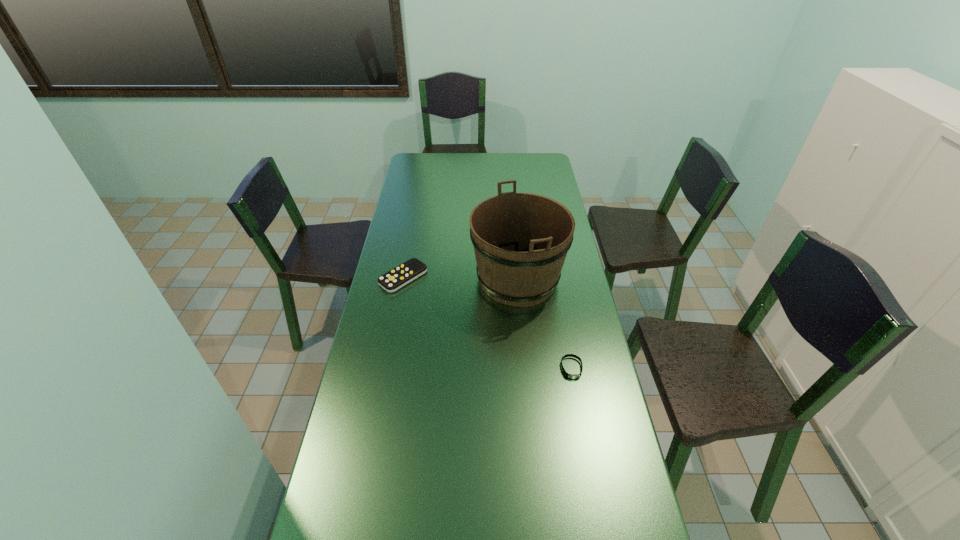
Where is `wristband positioned at the right edge`? Image resolution: width=960 pixels, height=540 pixels. wristband positioned at the right edge is located at coordinates (x=573, y=376).

Identify the location of free space at the far edge. (x=473, y=154).

Locate an element on the screen. free region at the left edge of the desktop is located at coordinates (356, 463).

Find the location of a particular element. Image resolution: width=960 pixels, height=540 pixels. vacant space at the right edge of the desktop is located at coordinates (623, 461).

At what (x,y) coordinates should I click in order to perform the action: click on free space at the far left corner of the desktop. Please return your answer as a coordinate pair (x, y). The width and height of the screenshot is (960, 540). Looking at the image, I should click on (428, 153).

This screenshot has width=960, height=540. I want to click on free region at the far right corner of the desktop, so click(537, 174).

You are a GUI agent. You are given a task and a screenshot of the screen. Output one action in this format:
    pyautogui.click(x=<x>, y=<y>)
    Task: Click on the free space between the remote control and the tallest object
    This screenshot has height=540, width=960.
    Given the screenshot: What is the action you would take?
    pyautogui.click(x=461, y=279)

The image size is (960, 540). In order to click on vacant region between the shortest object and the tallest object in this screenshot , I will do `click(544, 324)`.

The width and height of the screenshot is (960, 540). I want to click on free space that is in between the leftmost object and the bucket, so click(461, 279).

Identify which object is the nearest to the remote control. Please provide its 2D coordinates. Your answer should be formatted as a tuple, i.e. [(x, y)], where the tuple contains the x and y coordinates of a point satisfying the conditions above.

[(521, 240)]